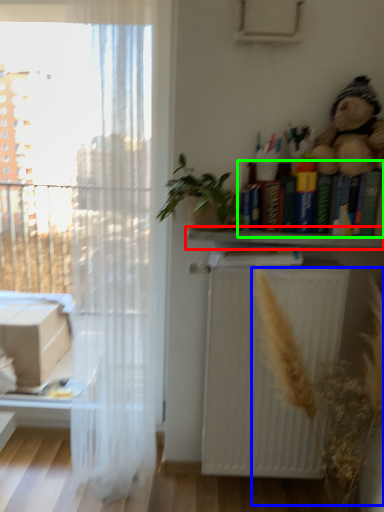
Question: Based on their relative distances, which object is farther from shelf (highlighted by a red box)? Choose from plant (highlighted by a blue box) and book (highlighted by a green box).

Choices:
 (A) plant
 (B) book

Answer: (A)